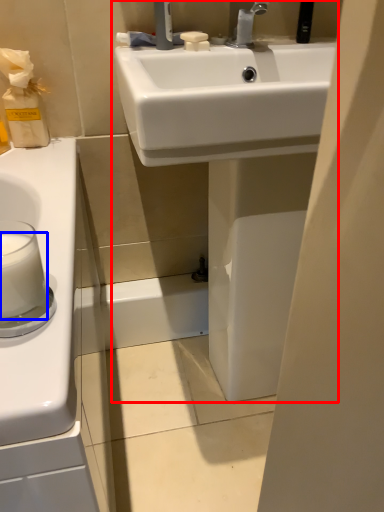
Question: Which of the following is the farthest to the observer, sink (highlighted by a red box) or milk (highlighted by a blue box)?

Choices:
 (A) sink
 (B) milk

Answer: (A)